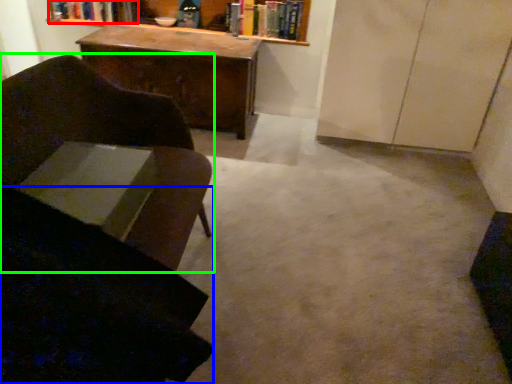
Question: Which object is the farthest from book (highlighted by a red box)? Choose among these: swivel chair (highlighted by a blue box) or chair (highlighted by a green box).

Choices:
 (A) swivel chair
 (B) chair

Answer: (A)